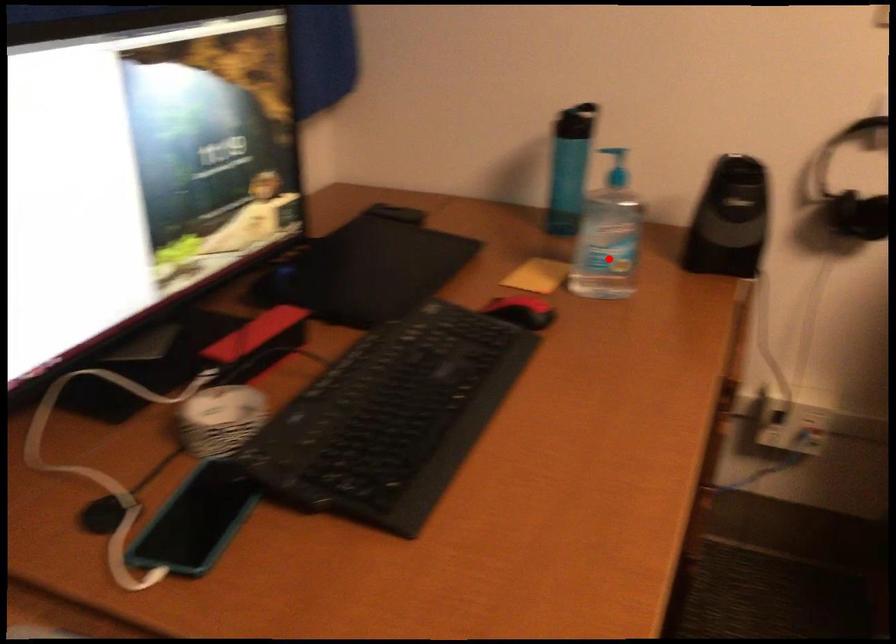
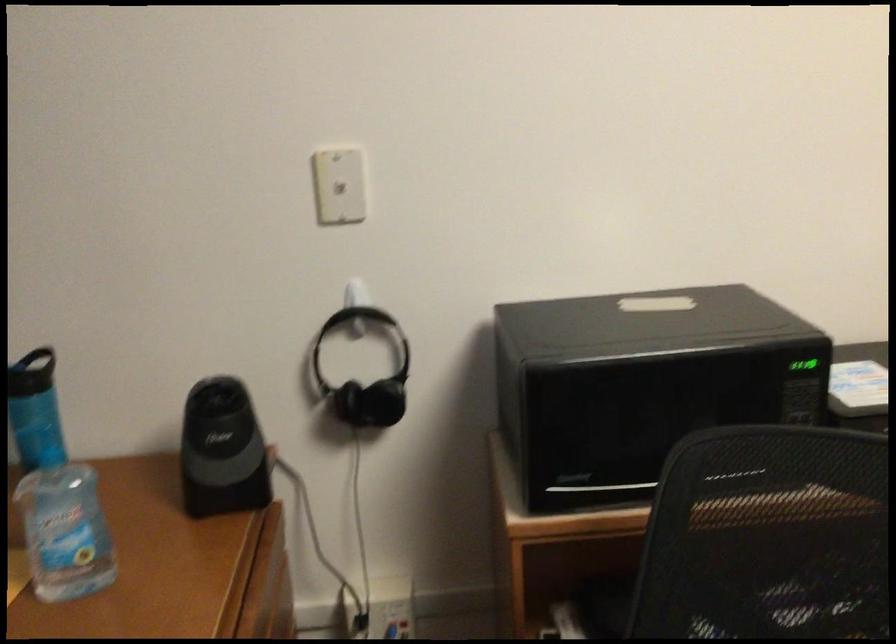
Find the pixel in the second image that matches the highlighted location in the first image.

(67, 556)